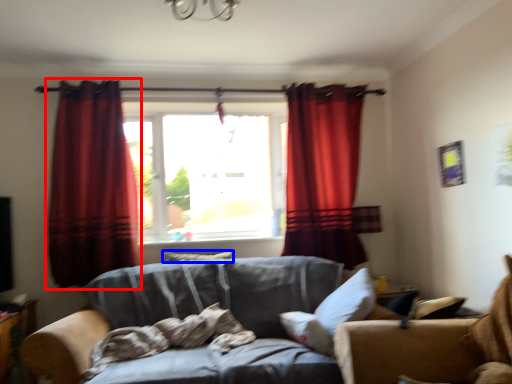
Question: Among these objects, which one is nearest to the camera, curtain (highlighted by a red box) or pillow (highlighted by a blue box)?

Choices:
 (A) curtain
 (B) pillow

Answer: (A)